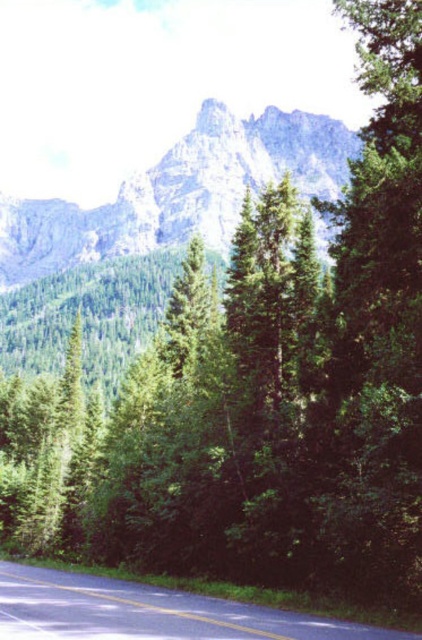
Question: Which point is farther from the camera taking this photo?

Choices:
 (A) (10, 232)
 (B) (265, 616)

Answer: (A)

Question: Is gray rocky mountain at upper center thinner than smooth asphalt road at lower center?

Choices:
 (A) no
 (B) yes

Answer: (A)

Question: Does gray rocky mountain at upper center appear under smooth asphalt road at lower center?

Choices:
 (A) yes
 (B) no

Answer: (B)

Question: In this image, where is gray rocky mountain at upper center located relative to smooth asphalt road at lower center?

Choices:
 (A) left
 (B) right

Answer: (A)

Question: Which point is closer to the camera?

Choices:
 (A) (64, 589)
 (B) (183, 141)

Answer: (A)